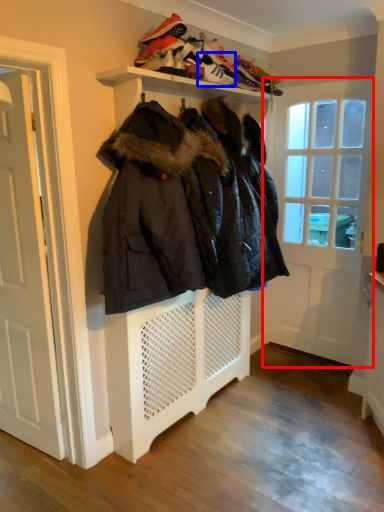
Question: Which object appears farthest to the camera in this image, door (highlighted by a red box) or shoe (highlighted by a blue box)?

Choices:
 (A) door
 (B) shoe

Answer: (A)